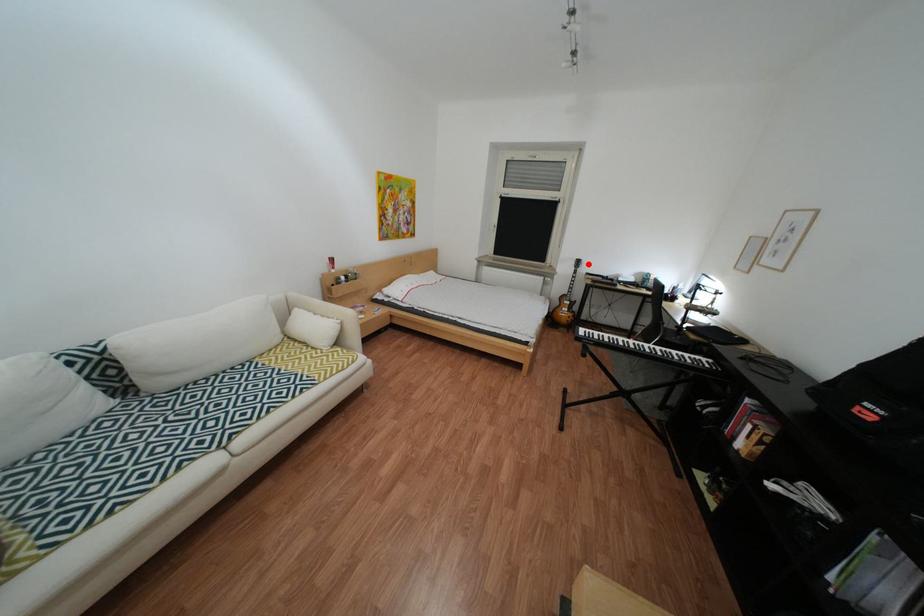
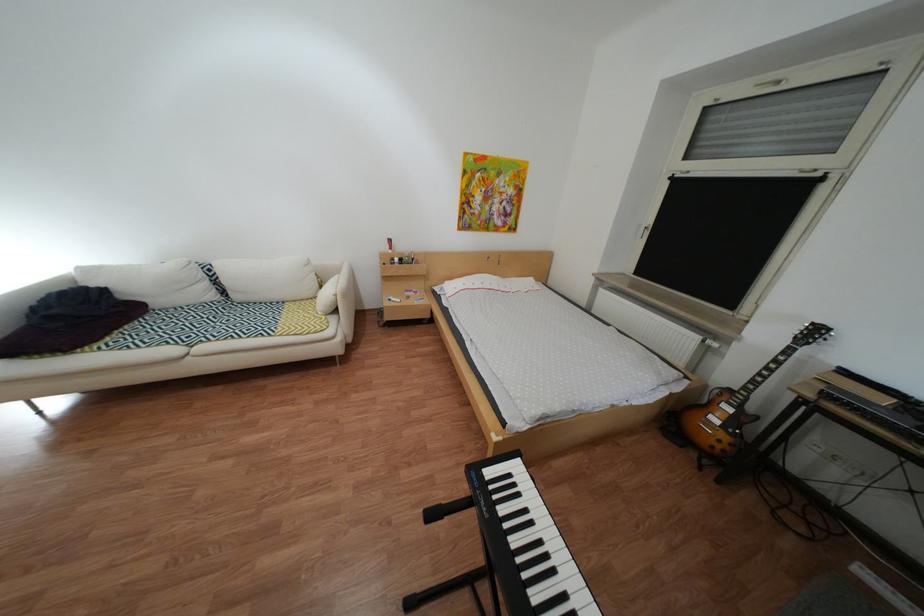
Question: I am providing you with two images of the same scene from different viewpoints. Given a red point in image1, look at the same physical point in image2. Is it:

Choices:
 (A) Closer to the viewpoint
 (B) Farther from the viewpoint

Answer: (B)